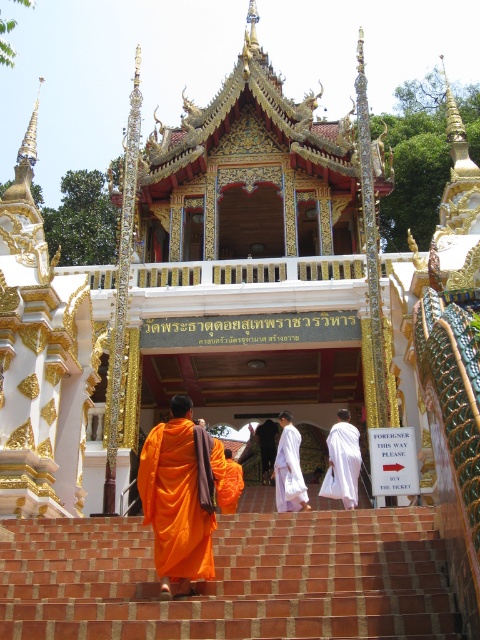
Is terracotta brick stairs at center smaller than white matte robe at center?

Correct, terracotta brick stairs at center occupies less space than white matte robe at center.

Can you confirm if terracotta brick stairs at center is wider than white matte robe at center?

Yes.

Is point (231, 621) farther from viewer compared to point (343, 417)?

That is False.

Identify the location of terracotta brick stairs at center. (231, 579).

Which is in front, point (126, 582) or point (147, 520)?

Point (147, 520)

Is terracotta brick stairs at center below orange cloth at center?

Indeed, terracotta brick stairs at center is positioned under orange cloth at center.

Is point (264, 566) positioned behind point (194, 564)?

Yes, point (264, 566) is farther from viewer.

Locate an element on the screen. Image resolution: width=480 pixels, height=640 pixels. terracotta brick stairs at center is located at coordinates (231, 579).

Between point (339, 483) and point (300, 484), which one is positioned behind?

Positioned behind is point (300, 484).

Is white matte robe at center further to camera compared to white silk robe at center?

No, it is not.

Is point (325, 483) farther from camera compared to point (282, 460)?

No, it is in front of (282, 460).

Image resolution: width=480 pixels, height=640 pixels. I want to click on white matte robe at center, so click(x=343, y=461).